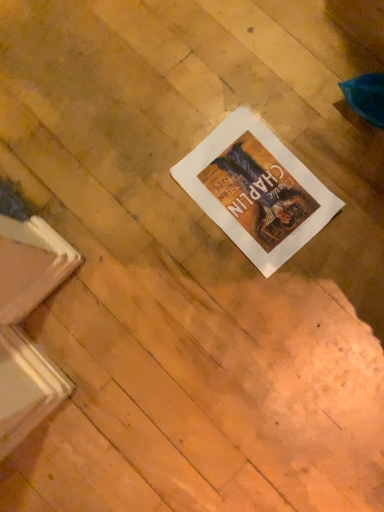
At what (x,y) coordinates should I click in order to perform the action: click on vacant space underneath white paper at center (from a real-world perspective). Please return your answer as a coordinate pair (x, y). The image size is (384, 512). Looking at the image, I should click on (254, 189).